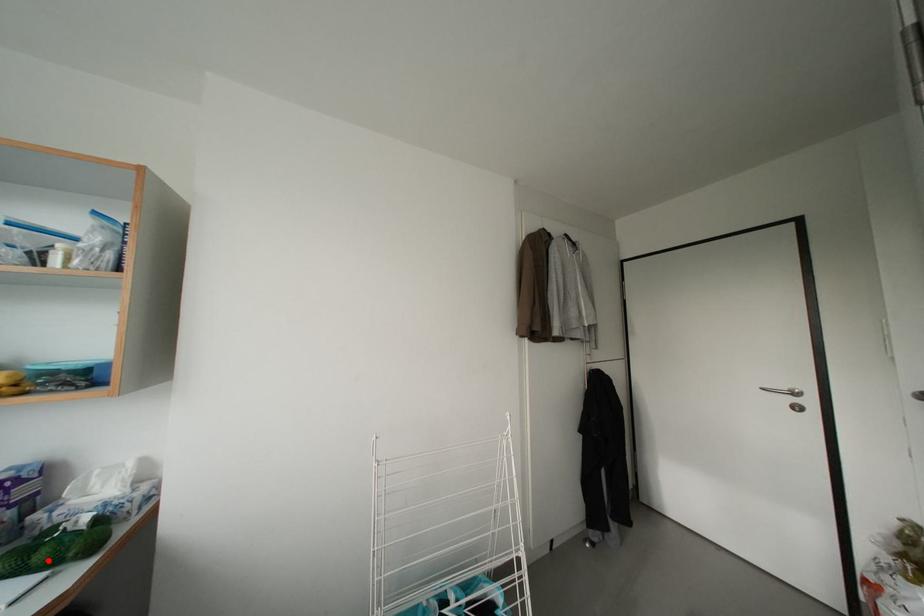
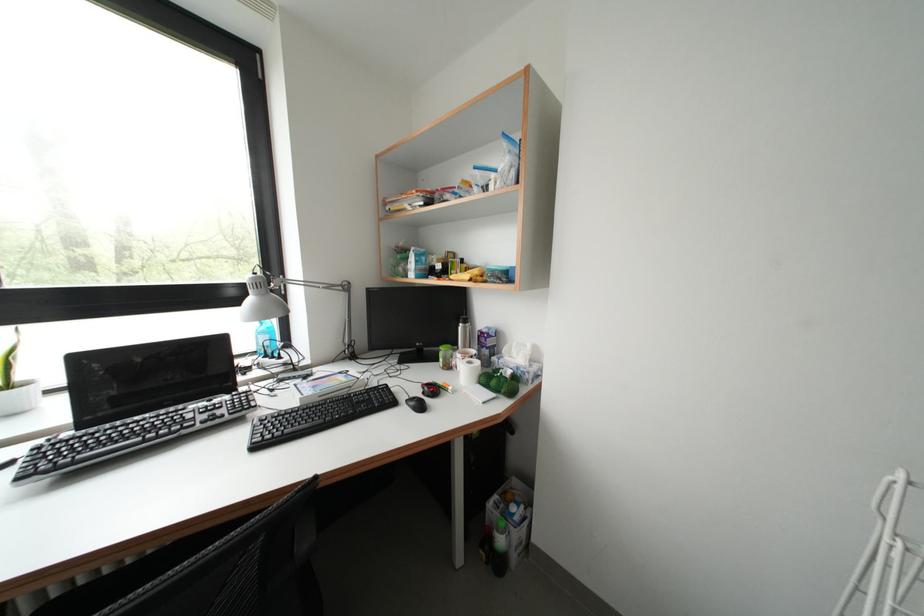
Question: I am providing you with two images of the same scene from different viewpoints. A red point is marked on the first image. Can you still see the location of the red point in image 2?

Choices:
 (A) Yes
 (B) No

Answer: (A)